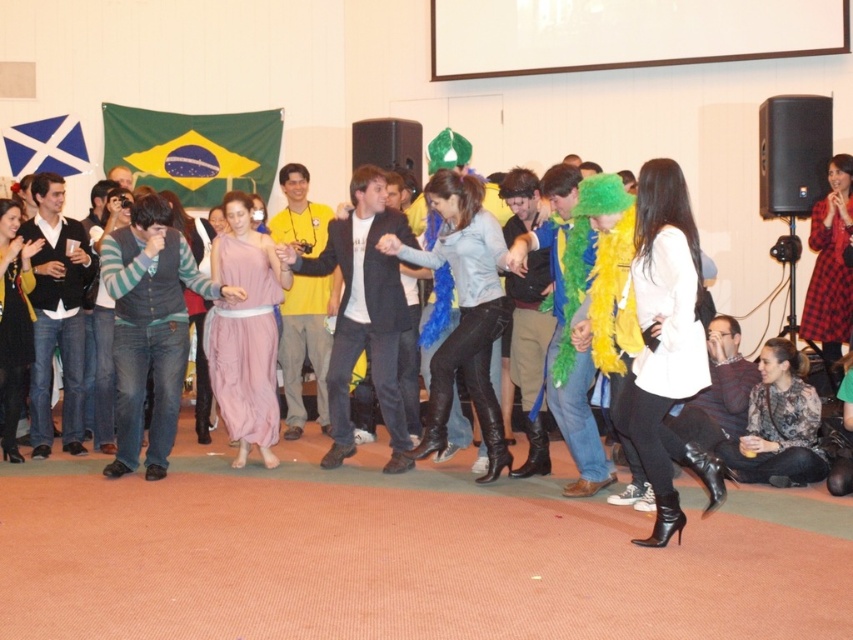
Question: Among these points, which one is nearest to the camera?

Choices:
 (A) (173, 314)
 (B) (73, 131)
 (C) (822, 208)

Answer: (A)

Question: Which point appears farthest from the camera in this image?

Choices:
 (A) (793, 348)
 (B) (61, 163)
 (C) (827, 280)
 (D) (596, 504)

Answer: (B)

Question: Can you confirm if matte black dress at center is positioned above green fabric flag at upper center?

Choices:
 (A) no
 (B) yes

Answer: (A)

Question: Does green fabric flag at upper center have a smaller size compared to plaid fabric dress at lower right?

Choices:
 (A) no
 (B) yes

Answer: (A)

Question: Is striped sweater at center wider than floral print blouse at lower right?

Choices:
 (A) no
 (B) yes

Answer: (B)

Question: Which point is closer to the camera taking this photo?

Choices:
 (A) (834, 506)
 (B) (763, 413)
 (C) (838, 269)
 (D) (163, 180)

Answer: (A)